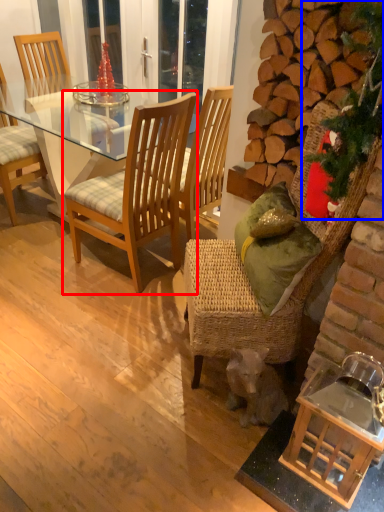
Question: Which of the following is the closest to the observer, chair (highlighted by a red box) or christmas decoration (highlighted by a blue box)?

Choices:
 (A) chair
 (B) christmas decoration

Answer: (B)